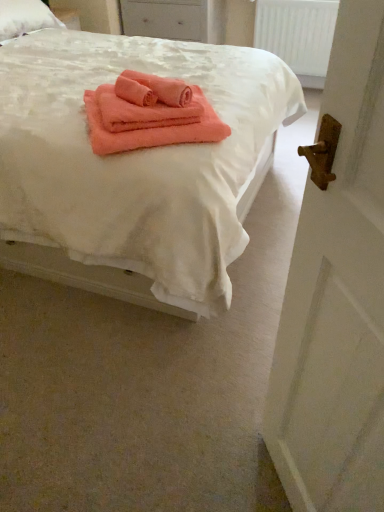
Question: Is coral soft towel at center smaller than coral soft towel at center?

Choices:
 (A) yes
 (B) no

Answer: (A)

Question: Would you say coral soft towel at center is outside coral soft towel at center?

Choices:
 (A) yes
 (B) no

Answer: (B)

Question: Can you confirm if coral soft towel at center is thinner than coral soft towel at center?

Choices:
 (A) yes
 (B) no

Answer: (A)

Question: Is coral soft towel at center not near coral soft towel at center?

Choices:
 (A) no
 (B) yes

Answer: (A)

Question: Is coral soft towel at center positioned in front of coral soft towel at center?

Choices:
 (A) yes
 (B) no

Answer: (B)

Question: Does point (360, 288) appear closer or farther from the camera than point (23, 100)?

Choices:
 (A) farther
 (B) closer

Answer: (B)

Question: Is white wooden door at right taller or shorter than coral soft towel at center?

Choices:
 (A) tall
 (B) short

Answer: (A)

Question: In the image, is white wooden door at right positioned in front of or behind coral soft towel at center?

Choices:
 (A) front
 (B) behind

Answer: (A)

Question: Based on their sizes in the image, would you say white wooden door at right is bigger or smaller than coral soft towel at center?

Choices:
 (A) small
 (B) big

Answer: (A)

Question: From the image's perspective, is white plastic radiator at upper center positioned above or below white matte drawer at upper center?

Choices:
 (A) above
 (B) below

Answer: (B)

Question: Is white plastic radiator at upper center taller or shorter than white matte drawer at upper center?

Choices:
 (A) tall
 (B) short

Answer: (A)

Question: From a real-world perspective, is white plastic radiator at upper center above or below white matte drawer at upper center?

Choices:
 (A) below
 (B) above

Answer: (A)

Question: Would you say white plastic radiator at upper center is inside or outside white matte drawer at upper center?

Choices:
 (A) inside
 (B) outside

Answer: (B)

Question: Is white plastic radiator at upper center taller or shorter than coral soft towel at center?

Choices:
 (A) tall
 (B) short

Answer: (B)

Question: Considering the relative positions of white plastic radiator at upper center and coral soft towel at center in the image provided, is white plastic radiator at upper center to the left or to the right of coral soft towel at center?

Choices:
 (A) right
 (B) left

Answer: (A)